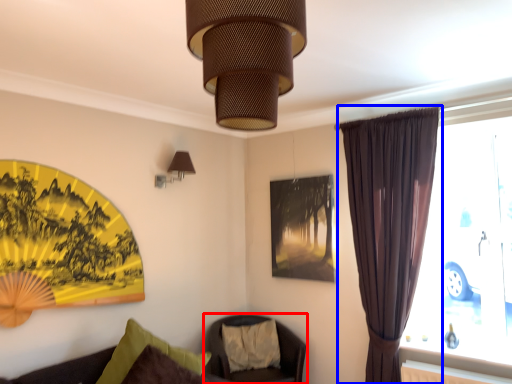
Question: Which of the following is the closest to the observer, chair (highlighted by a red box) or curtain (highlighted by a blue box)?

Choices:
 (A) chair
 (B) curtain

Answer: (B)